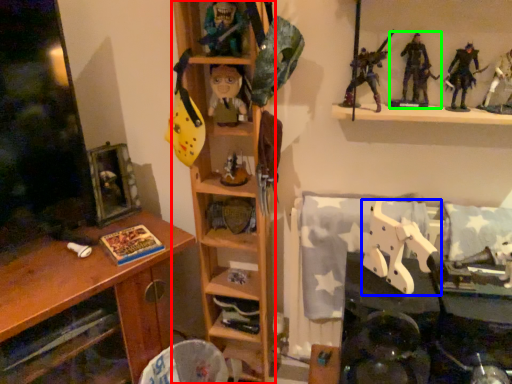
Question: Based on their relative distances, which object is nearer to shelf (highlighted by a red box)? Choose from toy (highlighted by a blue box) and toy (highlighted by a green box).

Choices:
 (A) toy
 (B) toy

Answer: (A)